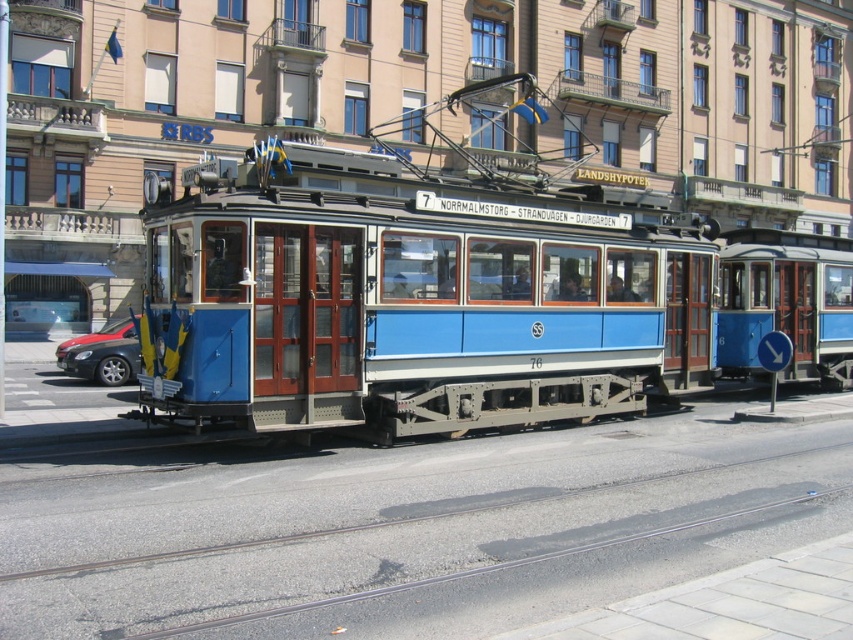
Does blue polished wood tram at center have a smaller size compared to metal/smooth track at lower center?

No.

Is blue polished wood tram at center taller than metal/smooth track at lower center?

Indeed, blue polished wood tram at center has a greater height compared to metal/smooth track at lower center.

Which is behind, point (154, 272) or point (165, 516)?

Point (154, 272)

Locate an element on the screen. Image resolution: width=853 pixels, height=640 pixels. blue polished wood tram at center is located at coordinates (419, 305).

Between metal/smooth track at lower center and red glossy car at left, which one has less height?

metal/smooth track at lower center is shorter.

Who is taller, metal/smooth track at lower center or red glossy car at left?

red glossy car at left

Who is more forward, (137, 525) or (62, 356)?

Point (137, 525)

You are a GUI agent. You are given a task and a screenshot of the screen. Output one action in this format:
    pyautogui.click(x=<x>, y=<y>)
    Task: Click on the metal/smooth track at lower center
    The width and height of the screenshot is (853, 640).
    Given the screenshot: What is the action you would take?
    pyautogui.click(x=410, y=531)

Is blue polished wood tram at center above shiny black sedan at left?

Yes, blue polished wood tram at center is above shiny black sedan at left.

Which is behind, point (152, 308) or point (117, 346)?

Point (117, 346)

Which is behind, point (515, 272) or point (70, 356)?

Point (70, 356)

The image size is (853, 640). Find the location of `blue polished wood tram at center`. blue polished wood tram at center is located at coordinates (419, 305).